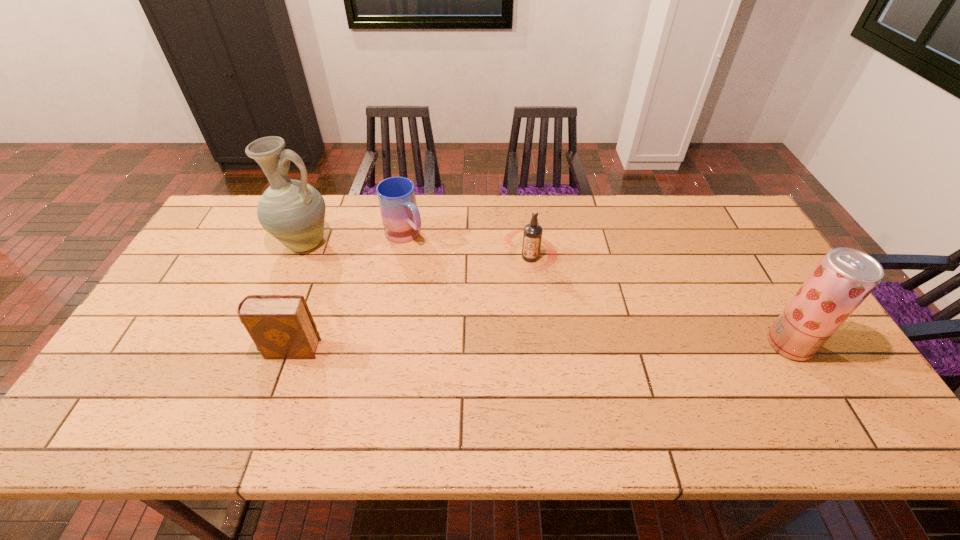
This screenshot has width=960, height=540. I want to click on free space located 0.340m on the side of the mug with the handle, so click(x=485, y=310).

The image size is (960, 540). Identify the location of vacant space located on the side of the mug with the handle. (483, 308).

The width and height of the screenshot is (960, 540). Find the location of `blank space located 0.110m on the side of the mug with the handle`. blank space located 0.110m on the side of the mug with the handle is located at coordinates (437, 266).

What are the coordinates of `vacant space located 0.370m on the label of the second object from right to left` in the screenshot? It's located at (463, 367).

Locate an element on the screen. The image size is (960, 540). vacant region located 0.390m on the label of the second object from right to left is located at coordinates (460, 373).

Identify the location of vacant area situated 0.190m on the label of the second object from right to left. The width and height of the screenshot is (960, 540). (493, 316).

What are the coordinates of `blank area located on the handle side of the tallest object` in the screenshot? It's located at (416, 313).

Image resolution: width=960 pixels, height=540 pixels. I want to click on free point located 0.100m on the handle side of the tallest object, so click(346, 269).

This screenshot has height=540, width=960. Identify the location of free space located on the handle side of the tallest object. (377, 289).

Identify the location of mug present at the far edge. This screenshot has height=540, width=960. (400, 216).